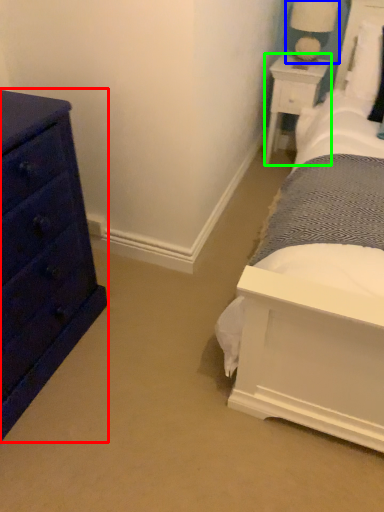
Question: Based on their relative distances, which object is nearer to chest of drawers (highlighted by a red box)? Choose from table lamp (highlighted by a blue box) and nightstand (highlighted by a green box).

Choices:
 (A) table lamp
 (B) nightstand

Answer: (B)